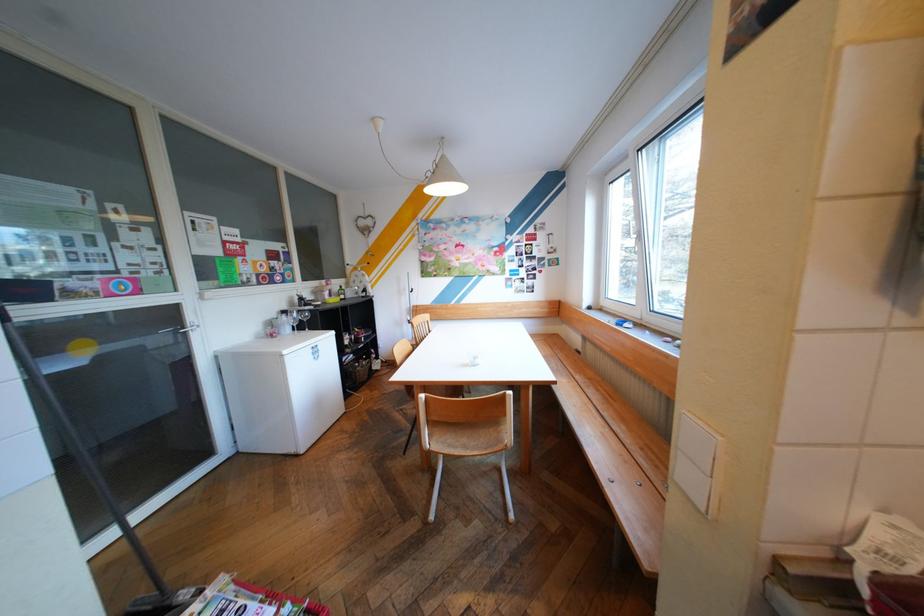
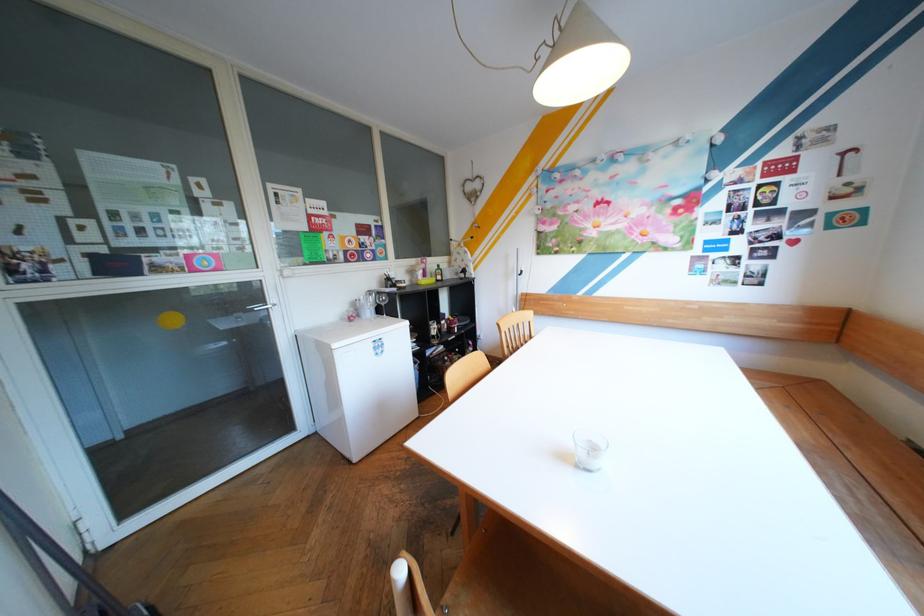
Where in the second image is the point corresponding to [283,339] from the first image?

(360, 322)